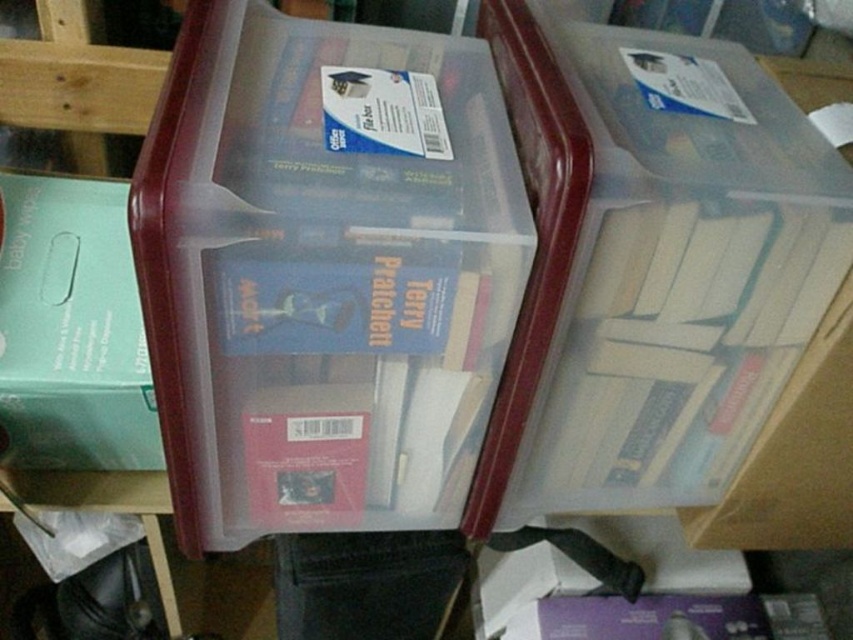
Question: Among these points, which one is nearest to the camera?

Choices:
 (A) (645, 289)
 (B) (112, 321)

Answer: (A)

Question: Is transparent plastic box at center to the left of teal matte baby wipes at left from the viewer's perspective?

Choices:
 (A) yes
 (B) no

Answer: (B)

Question: Which object appears farthest from the camera in this image?

Choices:
 (A) transparent plastic box at center
 (B) clear plastic box at upper right
 (C) teal matte baby wipes at left

Answer: (C)

Question: Can you confirm if clear plastic box at upper right is positioned below teal matte baby wipes at left?

Choices:
 (A) yes
 (B) no

Answer: (B)

Question: Does transparent plastic box at center have a smaller size compared to teal matte baby wipes at left?

Choices:
 (A) no
 (B) yes

Answer: (A)

Question: Which point is closer to the camera taking this photo?

Choices:
 (A) (187, 116)
 (B) (7, 216)

Answer: (A)